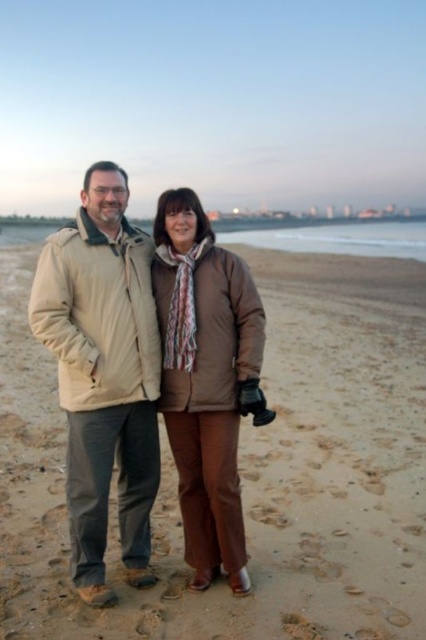
From the picture: You are standing on the beach and want to place a small flag exactly at the center of the brown sand at center. According to the coordinates provided, where should you place the flag?

You should place the flag at the coordinates point (250, 470) on the brown sand at center.

You are a photographer trying to capture a closeup of the brown sand at center and the brown matte jacket at center. Which object should you zoom in on more to ensure both are in focus?

The brown sand at center is larger in size than the brown matte jacket at center, so you should zoom in more on the brown matte jacket at center to ensure both are in focus.